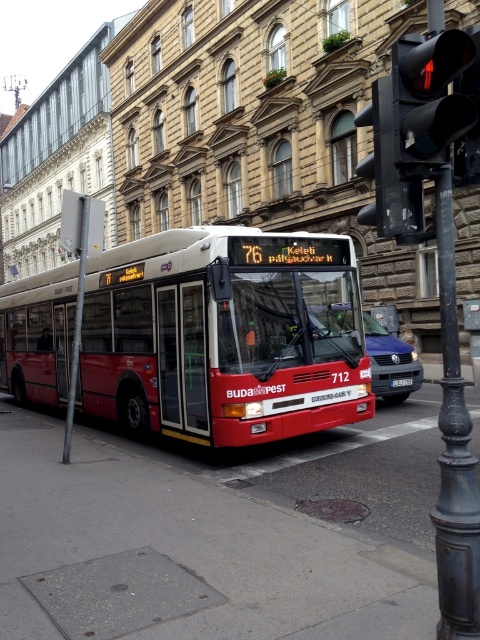
Question: Is black metal traffic light at right below black glass traffic light at upper right?

Choices:
 (A) no
 (B) yes

Answer: (B)

Question: From the image, what is the correct spatial relationship of gray concrete sidewalk at lower left in relation to black metal traffic light at right?

Choices:
 (A) below
 (B) above

Answer: (A)

Question: Estimate the real-world distances between objects in this image. Which object is closer to the matte black car at center?

Choices:
 (A) gray concrete sidewalk at lower left
 (B) black plastic license plate at center

Answer: (B)

Question: Which object is farther from the camera taking this photo?

Choices:
 (A) metallic bus stop at center
 (B) black metal traffic light at right
 (C) matte black car at center

Answer: (A)

Question: Is black glass traffic light at upper right to the left of metallic bus stop at center from the viewer's perspective?

Choices:
 (A) no
 (B) yes

Answer: (B)

Question: Estimate the real-world distances between objects in this image. Which object is farther from the matte black car at center?

Choices:
 (A) black plastic traffic light at upper right
 (B) metallic bus stop at center

Answer: (B)